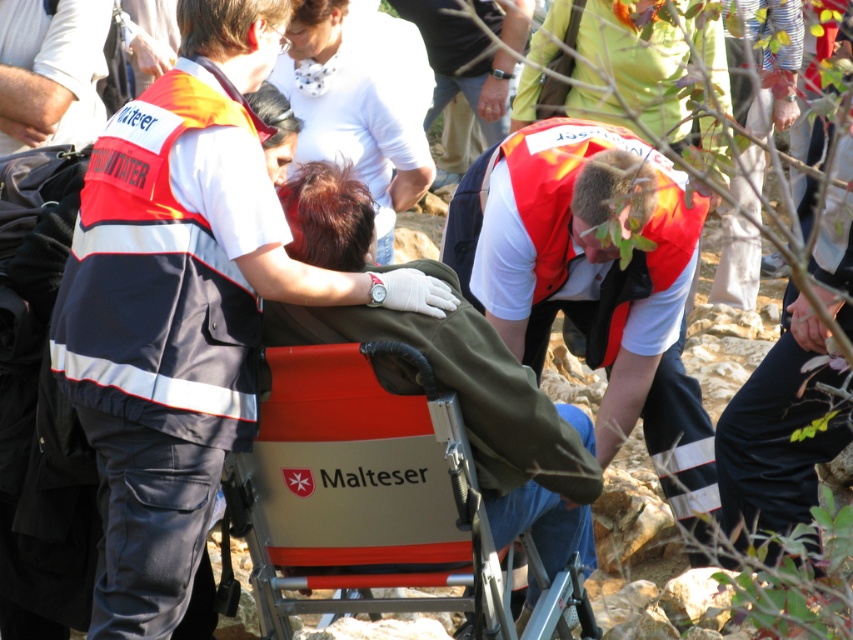
Question: Estimate the real-world distances between objects in this image. Which object is farther from the red aluminum malteser stretcher at center?

Choices:
 (A) reflective orange vest at center
 (B) red reflective vest at center
 (C) orange reflective vest at center

Answer: (C)

Question: Estimate the real-world distances between objects in this image. Which object is closer to the red reflective vest at center?

Choices:
 (A) red aluminum malteser stretcher at center
 (B) reflective orange vest at center

Answer: (A)

Question: Does reflective orange vest at center appear on the left side of red aluminum malteser stretcher at center?

Choices:
 (A) yes
 (B) no

Answer: (A)

Question: Does red reflective vest at center have a larger size compared to orange reflective vest at center?

Choices:
 (A) no
 (B) yes

Answer: (B)

Question: Is reflective orange vest at center bigger than orange reflective vest at center?

Choices:
 (A) no
 (B) yes

Answer: (B)

Question: Which of the following is the closest to the observer?

Choices:
 (A) click(407, 408)
 (B) click(160, 122)
 (C) click(634, 417)
 (D) click(503, 112)

Answer: (B)